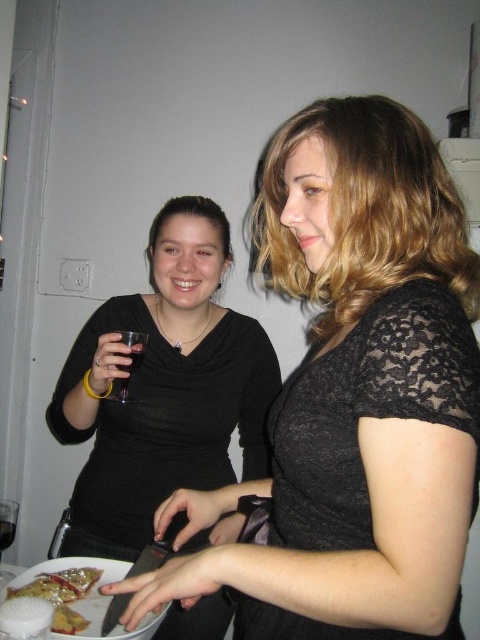
You are at a party and want to hand a napkin to the person wearing the matte black shirt at center. Since the clear glass wine glass at lower left is in the way, can you move the napkin around the glass to reach them?

The matte black shirt at center is to the right of the clear glass wine glass at lower left, so you can move the napkin around the glass to the right side to reach them.

You are standing in the room and want to hand a drink to the person wearing the matte black shirt at center. Based on their position, which direction should you approach from?

The matte black shirt at center is located at point (164, 388), so you should approach from the left side to reach them effectively.

You are a photographer setting up a shot of the scene described. You want to ensure that the matte black shirt at center and the clear glass wine glass at lower left are both in focus. Based on their positions, which object should you focus on first to ensure both are sharp?

The matte black shirt at center is above the clear glass wine glass at lower left, so focusing on the matte black shirt at center first will help ensure both are in focus since it is closer to the camera.